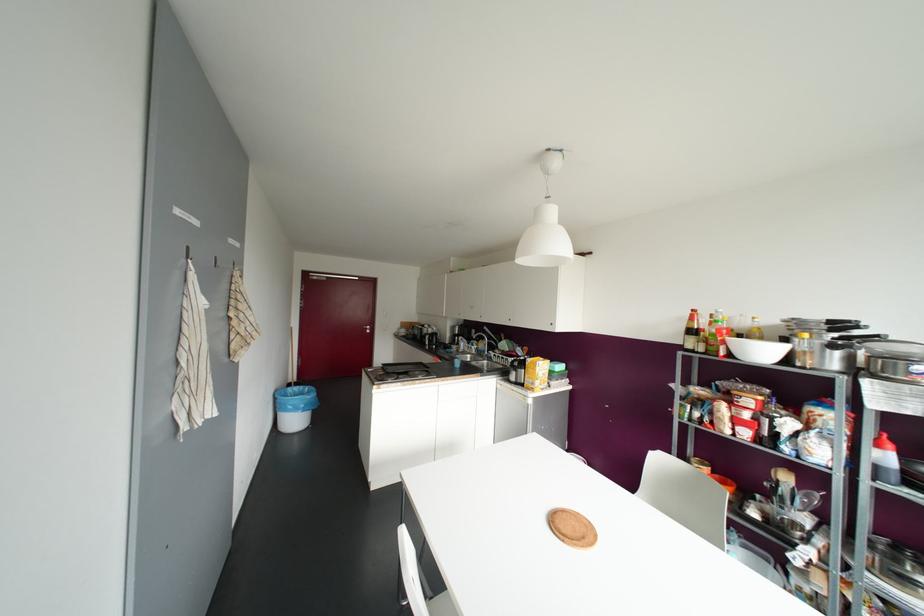
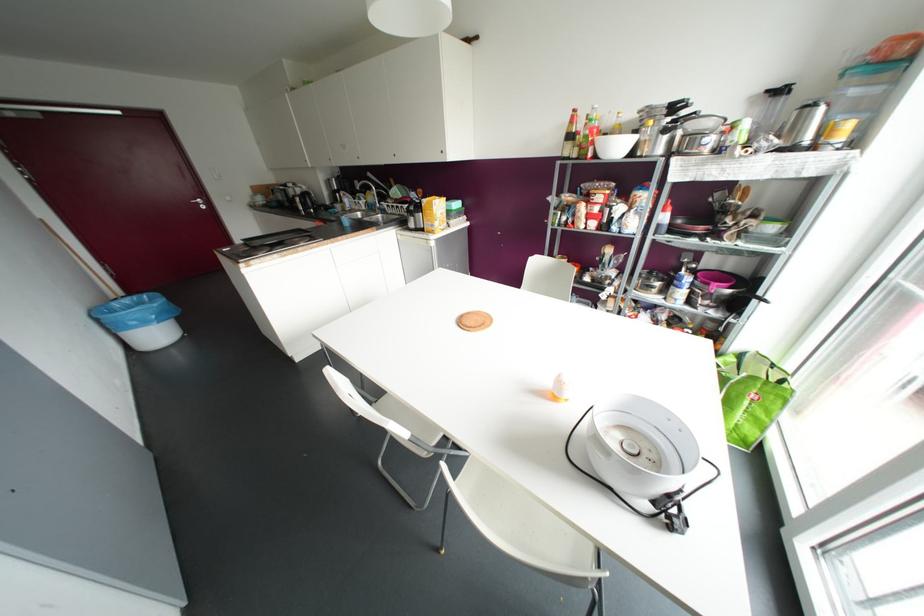
In the second image, find the point that corresponds to point (835, 325) in the first image.

(673, 107)